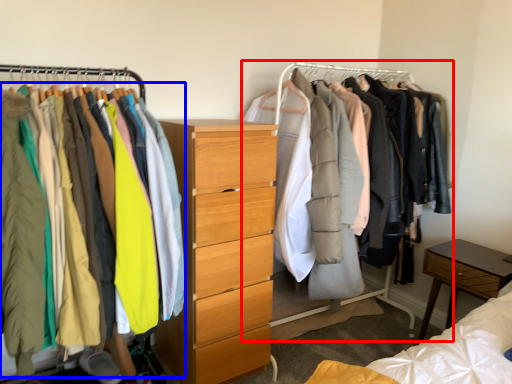
Question: Among these objects, which one is farthest to the camera, closet (highlighted by a red box) or clothing (highlighted by a blue box)?

Choices:
 (A) closet
 (B) clothing

Answer: (A)